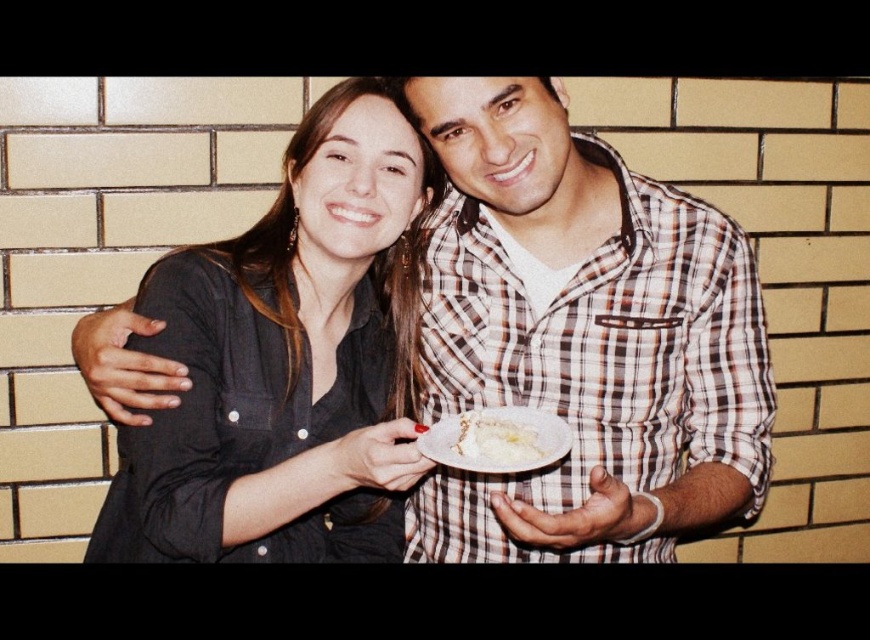
Question: Which object is farther from the camera taking this photo?

Choices:
 (A) matte black shirt at center
 (B) white creamy cake at center

Answer: (A)

Question: Estimate the real-world distances between objects in this image. Which object is farther from the checkered fabric shirt at center?

Choices:
 (A) white creamy cake at center
 (B) matte black shirt at center

Answer: (B)

Question: Does matte black shirt at center appear on the right side of white creamy cake at center?

Choices:
 (A) no
 (B) yes

Answer: (A)

Question: Which point is closer to the camera?

Choices:
 (A) (507, 444)
 (B) (306, 385)

Answer: (A)

Question: Does checkered fabric shirt at center have a larger size compared to matte black shirt at center?

Choices:
 (A) yes
 (B) no

Answer: (A)

Question: Can you confirm if matte black shirt at center is positioned to the right of white creamy cake at center?

Choices:
 (A) no
 (B) yes

Answer: (A)